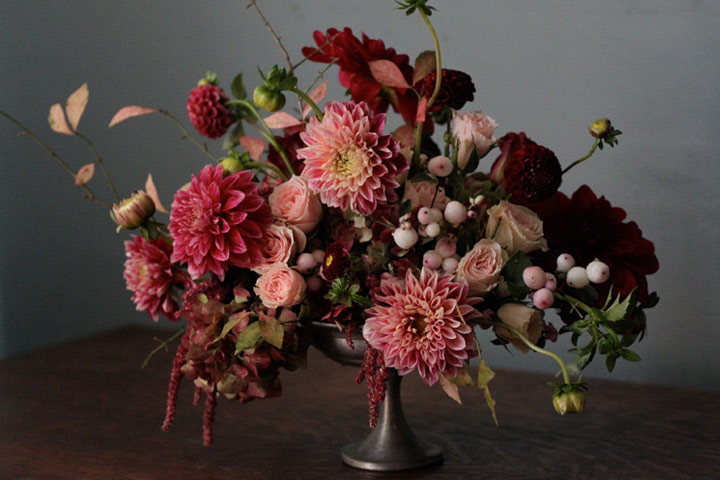
Where is `corner of table`? Image resolution: width=720 pixels, height=480 pixels. corner of table is located at coordinates (127, 323).